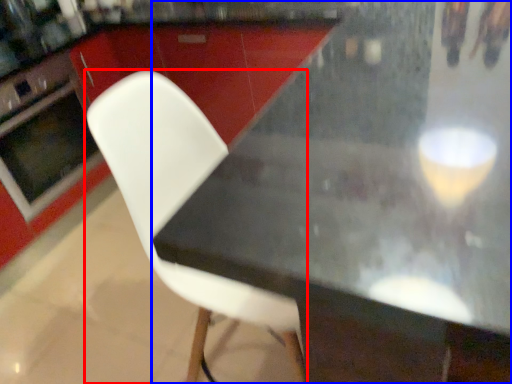
Question: Which of the following is the closest to the observer, chair (highlighted by a red box) or table (highlighted by a blue box)?

Choices:
 (A) chair
 (B) table

Answer: (B)